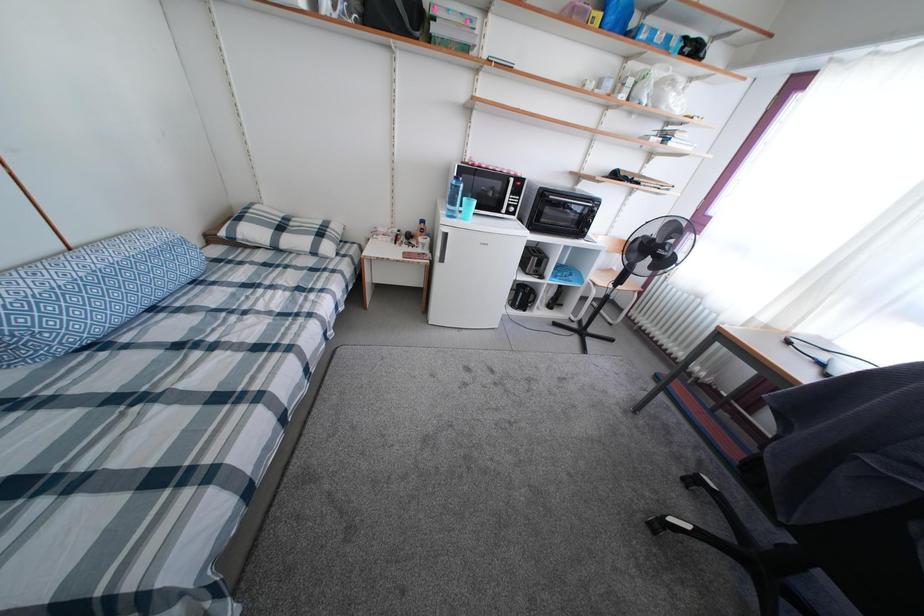
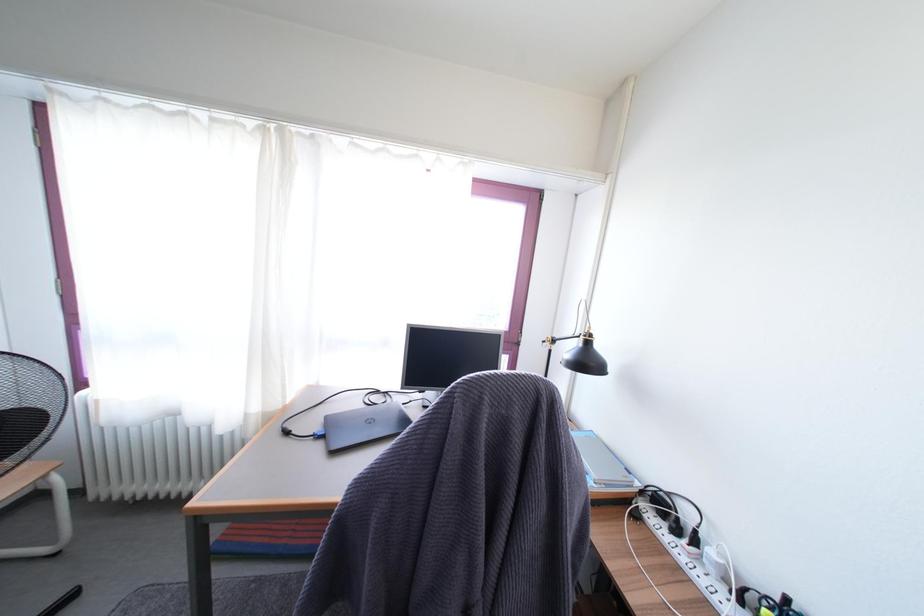
Based on the continuous images, in which direction is the camera rotating?

The camera rotated toward right-down.